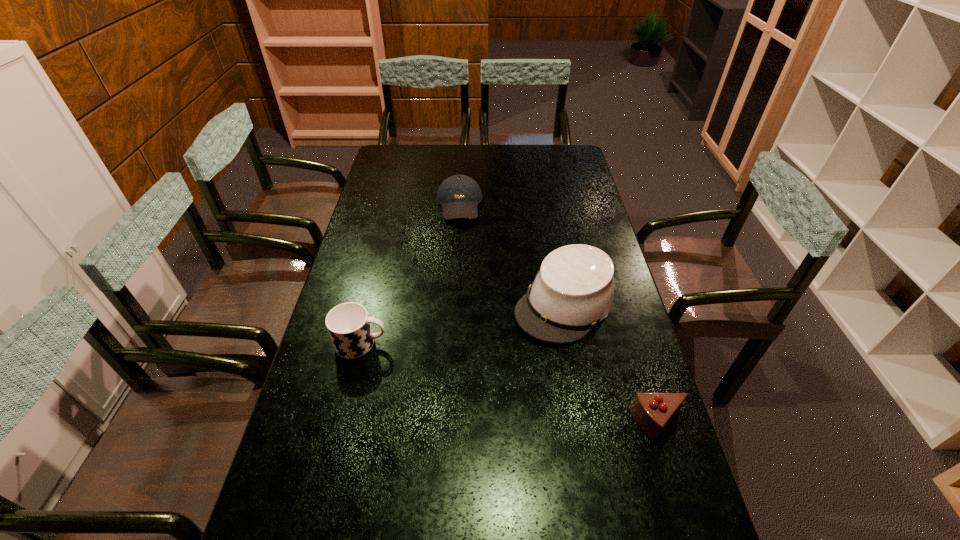
You are a GUI agent. You are given a task and a screenshot of the screen. Output one action in this format:
    pyautogui.click(x=<x>, y=<y>)
    Task: Click on the vacant area situated 0.070m on the front-facing side of the farthest object
    The width and height of the screenshot is (960, 540).
    Given the screenshot: What is the action you would take?
    pyautogui.click(x=460, y=237)

Image resolution: width=960 pixels, height=540 pixels. Identify the location of vacant area located 0.180m on the front-facing side of the farthest object. (461, 256).

Where is `vacant space located 0.070m on the front-facing side of the farthest object`? This screenshot has width=960, height=540. vacant space located 0.070m on the front-facing side of the farthest object is located at coordinates (460, 237).

Find the location of `object that is at the left edge`. object that is at the left edge is located at coordinates (348, 324).

Locate an element on the screen. The image size is (960, 540). chocolate cake at the right edge is located at coordinates (652, 412).

Where is `hat that is at the right edge`? This screenshot has width=960, height=540. hat that is at the right edge is located at coordinates (573, 291).

What are the coordinates of `blank area at the far edge` in the screenshot? It's located at (485, 147).

The height and width of the screenshot is (540, 960). Find the location of `free space at the near edge of the desktop`. free space at the near edge of the desktop is located at coordinates (604, 500).

At what (x,y) coordinates should I click in order to perform the action: click on free space at the left edge of the desktop. Please return your answer as a coordinate pair (x, y). This screenshot has height=540, width=960. Looking at the image, I should click on (315, 365).

The image size is (960, 540). Find the location of `vacant space at the right edge of the desktop`. vacant space at the right edge of the desktop is located at coordinates (643, 370).